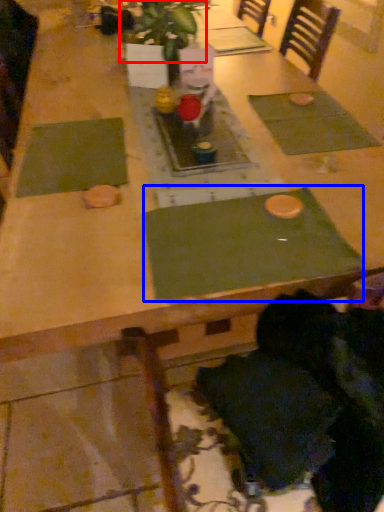
Question: Among these objects, which one is farthest to the camera, plant (highlighted by a red box) or place mat (highlighted by a blue box)?

Choices:
 (A) plant
 (B) place mat

Answer: (A)